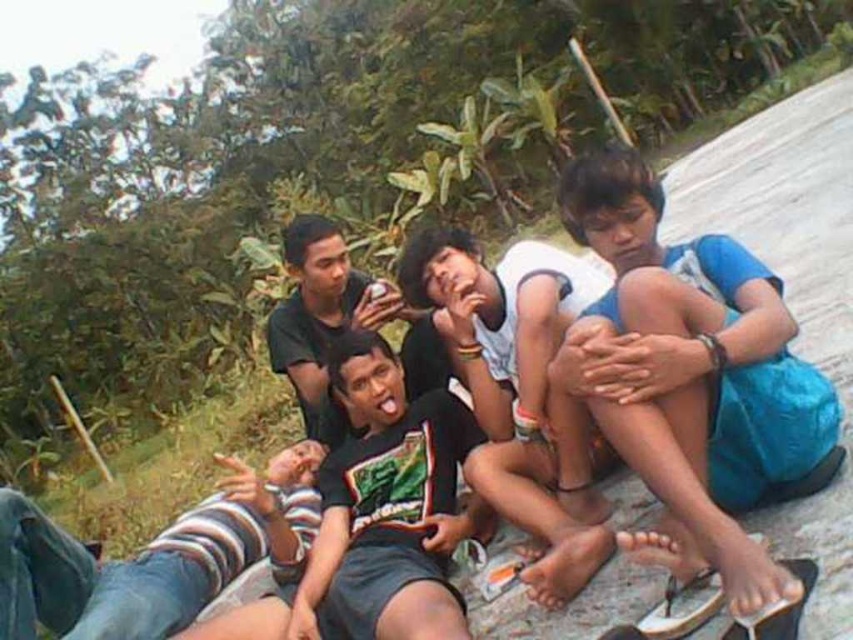
Question: Which object is closer to the camera taking this photo?

Choices:
 (A) white rubber sandal at lower right
 (B) black matte shirt at center

Answer: (A)

Question: Does black matte shirt at center have a lesser width compared to white rubber sandal at lower right?

Choices:
 (A) no
 (B) yes

Answer: (B)

Question: Does black matte shirt at center have a smaller size compared to white rubber sandal at lower right?

Choices:
 (A) yes
 (B) no

Answer: (A)

Question: Is black matte shirt at center below white rubber sandal at lower right?

Choices:
 (A) yes
 (B) no

Answer: (B)

Question: Which object is farther from the camera taking this photo?

Choices:
 (A) black matte shirt at center
 (B) white rubber sandal at lower right

Answer: (A)